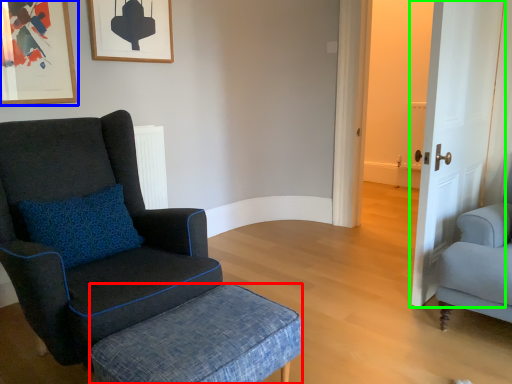
Question: Which object is the farthest from stool (highlighted by a red box)? Choose among these: picture frame (highlighted by a blue box) or door (highlighted by a green box).

Choices:
 (A) picture frame
 (B) door

Answer: (A)